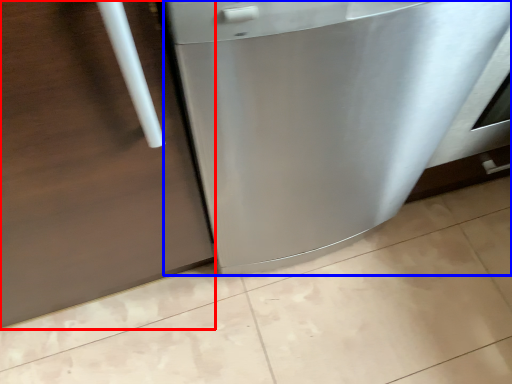
Question: Which of the following is the closest to the observer, door (highlighted by a red box) or home appliance (highlighted by a blue box)?

Choices:
 (A) door
 (B) home appliance

Answer: (A)